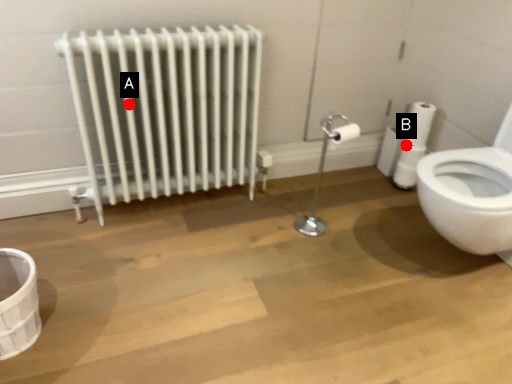
Question: Two points are circled on the image, labeled by A and B beside each circle. Which point appears farthest from the camera in this image?

Choices:
 (A) A is further
 (B) B is further

Answer: (B)